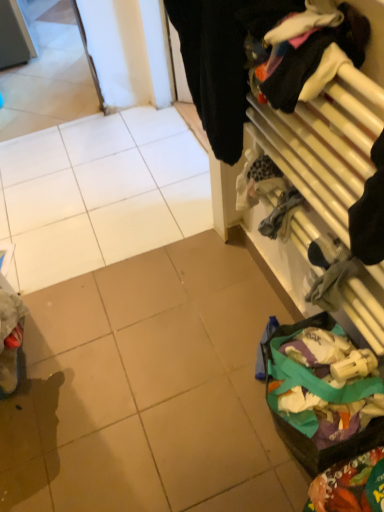
Question: Is multicolored fabric at lower right, which appears as the 2th waste when viewed from the back, touching black fabric at upper right?

Choices:
 (A) no
 (B) yes

Answer: (A)

Question: Is multicolored fabric at lower right, the first waste positioned from the front, taller than black fabric at upper right?

Choices:
 (A) no
 (B) yes

Answer: (A)

Question: Could you tell me if multicolored fabric at lower right, which appears as the 2th waste when viewed from the back, is turned towards black fabric at upper right?

Choices:
 (A) yes
 (B) no

Answer: (B)

Question: Can you confirm if multicolored fabric at lower right, the first waste positioned from the front, is shorter than black fabric at upper right?

Choices:
 (A) no
 (B) yes

Answer: (B)

Question: From the image's perspective, would you say multicolored fabric at lower right, which appears as the 2th waste when viewed from the back, is shown under black fabric at upper right?

Choices:
 (A) no
 (B) yes

Answer: (B)

Question: Would you say multicolored fabric at lower right, the first waste positioned from the front, contains black fabric at upper right?

Choices:
 (A) yes
 (B) no

Answer: (B)

Question: Does multicolored fabric at lower right, which appears as the 2th waste when viewed from the back, lie in front of multicolored fabric bag at lower right, the 1th waste positioned from the back?

Choices:
 (A) yes
 (B) no

Answer: (A)

Question: From the image's perspective, is multicolored fabric at lower right, the first waste positioned from the front, beneath multicolored fabric bag at lower right, the 2th waste from the front?

Choices:
 (A) yes
 (B) no

Answer: (A)

Question: Is multicolored fabric at lower right, which appears as the 2th waste when viewed from the back, far from multicolored fabric bag at lower right, the 2th waste from the front?

Choices:
 (A) yes
 (B) no

Answer: (B)

Question: Considering the relative sizes of multicolored fabric at lower right, which appears as the 2th waste when viewed from the back, and multicolored fabric bag at lower right, the 2th waste from the front, in the image provided, is multicolored fabric at lower right, which appears as the 2th waste when viewed from the back, wider than multicolored fabric bag at lower right, the 2th waste from the front,?

Choices:
 (A) no
 (B) yes

Answer: (A)

Question: Is multicolored fabric bag at lower right, the 2th waste from the front, surrounded by multicolored fabric at lower right, which appears as the 2th waste when viewed from the back?

Choices:
 (A) yes
 (B) no

Answer: (B)

Question: Is multicolored fabric at lower right, the first waste positioned from the front, at the left side of multicolored fabric bag at lower right, the 1th waste positioned from the back?

Choices:
 (A) no
 (B) yes

Answer: (A)

Question: Can you see black fabric at upper right touching multicolored fabric at lower right, which appears as the 2th waste when viewed from the back?

Choices:
 (A) no
 (B) yes

Answer: (A)